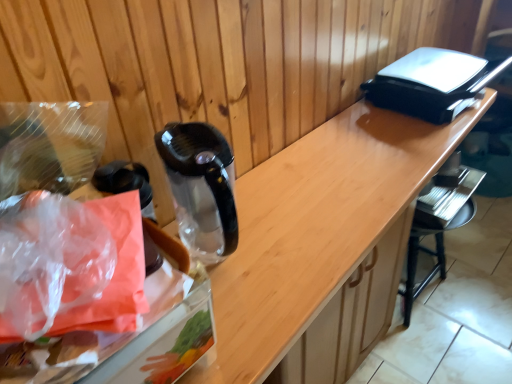
I want to click on free spot above wooden counter at center (from a real-world perspective), so click(x=345, y=186).